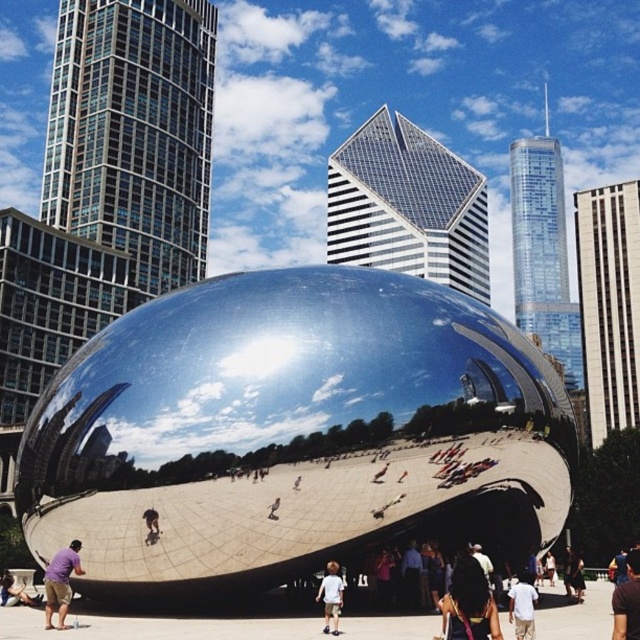
Who is more forward, (461, 570) or (628, 604)?

Positioned in front is point (628, 604).

How far apart are dark brown hair at center and brown fabric shirt at lower right?

The distance of dark brown hair at center from brown fabric shirt at lower right is 3.69 meters.

Who is more forward, (460, 609) or (637, 580)?

Point (460, 609) is in front.

The image size is (640, 640). Find the location of `dark brown hair at center`. dark brown hair at center is located at coordinates (468, 604).

Who is positioned more to the left, dark brown hair at center or white cotton shirt at lower center?

From the viewer's perspective, dark brown hair at center appears more on the left side.

Can you confirm if dark brown hair at center is smaller than white cotton shirt at lower center?

No.

Which is in front, point (470, 595) or point (516, 604)?

Point (470, 595)

Where is `dark brown hair at center`? The width and height of the screenshot is (640, 640). dark brown hair at center is located at coordinates (468, 604).

Does brown fabric shirt at lower right appear on the left side of white cotton shirt at center?

Incorrect, brown fabric shirt at lower right is not on the left side of white cotton shirt at center.

Is brown fabric shirt at lower right in front of white cotton shirt at center?

Yes, it is in front of white cotton shirt at center.

Where is `brown fabric shirt at lower right`? The width and height of the screenshot is (640, 640). brown fabric shirt at lower right is located at coordinates (627, 600).